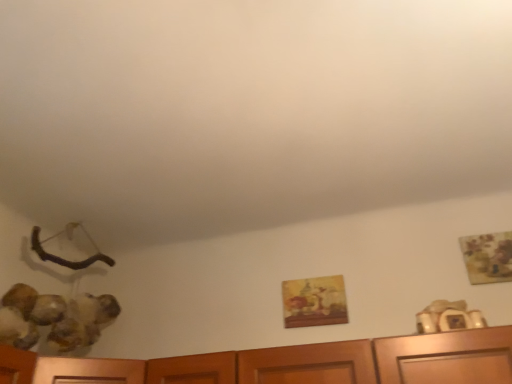
This screenshot has height=384, width=512. What do you see at coordinates (314, 301) in the screenshot? I see `matte wooden picture frame at center, placed as the 1th picture frame when sorted from back to front` at bounding box center [314, 301].

Where is `matte wooden picture frame at center, which is the 1th picture frame from bottom to top`? This screenshot has height=384, width=512. matte wooden picture frame at center, which is the 1th picture frame from bottom to top is located at coordinates (314, 301).

Identify the location of wooden painted picture frame at upper right, which is counted as the 2th picture frame, starting from the left. (488, 257).

Image resolution: width=512 pixels, height=384 pixels. What do you see at coordinates (488, 257) in the screenshot?
I see `wooden painted picture frame at upper right, the second picture frame viewed from the back` at bounding box center [488, 257].

Identify the location of matte wooden picture frame at center, marked as the first picture frame in a left-to-right arrangement. This screenshot has height=384, width=512. (314, 301).

Looking at this image, is matte wooden picture frame at center, acting as the 2th picture frame starting from the front, to the left or to the right of wooden painted picture frame at upper right, the first picture frame viewed from the top, in the image?

In the image, matte wooden picture frame at center, acting as the 2th picture frame starting from the front, appears on the left side of wooden painted picture frame at upper right, the first picture frame viewed from the top.

Is matte wooden picture frame at center, positioned as the second picture frame in right-to-left order, further to the viewer compared to wooden painted picture frame at upper right, which is counted as the 2th picture frame, starting from the left?

Yes, matte wooden picture frame at center, positioned as the second picture frame in right-to-left order, is further from the camera.

Which is further, (320, 301) or (478, 277)?

The point (320, 301) is behind.

From the image's perspective, is matte wooden picture frame at center, positioned as the second picture frame in right-to-left order, located above or below wooden painted picture frame at upper right, which is counted as the 1th picture frame, starting from the front?

matte wooden picture frame at center, positioned as the second picture frame in right-to-left order, is situated lower than wooden painted picture frame at upper right, which is counted as the 1th picture frame, starting from the front, in the image.

In the scene shown: From a real-world perspective, relative to wooden painted picture frame at upper right, which is the 1th picture frame from right to left, is matte wooden picture frame at center, arranged as the 2th picture frame when viewed from the top, vertically above or below?

matte wooden picture frame at center, arranged as the 2th picture frame when viewed from the top, is below wooden painted picture frame at upper right, which is the 1th picture frame from right to left.

Can you confirm if matte wooden picture frame at center, arranged as the 2th picture frame when viewed from the top, is wider than wooden painted picture frame at upper right, the first picture frame viewed from the top?

Yes.

Considering the sizes of objects matte wooden picture frame at center, which is the 1th picture frame from bottom to top, and wooden painted picture frame at upper right, the first picture frame viewed from the top, in the image provided, who is shorter, matte wooden picture frame at center, which is the 1th picture frame from bottom to top, or wooden painted picture frame at upper right, the first picture frame viewed from the top,?

Standing shorter between the two is matte wooden picture frame at center, which is the 1th picture frame from bottom to top.

Who is smaller, matte wooden picture frame at center, positioned as the second picture frame in right-to-left order, or wooden painted picture frame at upper right, which is the 1th picture frame from right to left?

wooden painted picture frame at upper right, which is the 1th picture frame from right to left, is smaller.

Can we say matte wooden picture frame at center, placed as the 1th picture frame when sorted from back to front, lies outside wooden painted picture frame at upper right, which is counted as the 2th picture frame, starting from the left?

matte wooden picture frame at center, placed as the 1th picture frame when sorted from back to front, is positioned outside wooden painted picture frame at upper right, which is counted as the 2th picture frame, starting from the left.

Is matte wooden picture frame at center, which is the 1th picture frame from bottom to top, placed right next to wooden painted picture frame at upper right, the first picture frame viewed from the top?

matte wooden picture frame at center, which is the 1th picture frame from bottom to top, and wooden painted picture frame at upper right, the first picture frame viewed from the top, are clearly separated.

Is matte wooden picture frame at center, marked as the first picture frame in a left-to-right arrangement, turned away from wooden painted picture frame at upper right, the second picture frame viewed from the back?

No, matte wooden picture frame at center, marked as the first picture frame in a left-to-right arrangement, is not facing the opposite direction of wooden painted picture frame at upper right, the second picture frame viewed from the back.

What are the coordinates of `picture frame below the wooden painted picture frame at upper right, which is counted as the 2th picture frame, starting from the left (from the image's perspective)` in the screenshot? It's located at (314, 301).

Considering the positions of objects wooden painted picture frame at upper right, the second picture frame positioned from the bottom, and matte wooden picture frame at center, arranged as the 2th picture frame when viewed from the top, in the image provided, who is more to the right, wooden painted picture frame at upper right, the second picture frame positioned from the bottom, or matte wooden picture frame at center, arranged as the 2th picture frame when viewed from the top,?

wooden painted picture frame at upper right, the second picture frame positioned from the bottom, is more to the right.

Who is more distant, wooden painted picture frame at upper right, the second picture frame positioned from the bottom, or matte wooden picture frame at center, marked as the first picture frame in a left-to-right arrangement?

matte wooden picture frame at center, marked as the first picture frame in a left-to-right arrangement.

Is point (487, 266) positioned in front of point (305, 281)?

Yes, point (487, 266) is in front of point (305, 281).

From the image's perspective, would you say wooden painted picture frame at upper right, which is the 1th picture frame from right to left, is shown under matte wooden picture frame at center, which is the 1th picture frame from bottom to top?

Actually, wooden painted picture frame at upper right, which is the 1th picture frame from right to left, appears above matte wooden picture frame at center, which is the 1th picture frame from bottom to top, in the image.

From a real-world perspective, is wooden painted picture frame at upper right, the second picture frame positioned from the bottom, positioned over matte wooden picture frame at center, arranged as the 2th picture frame when viewed from the top, based on gravity?

Correct, in the physical world, wooden painted picture frame at upper right, the second picture frame positioned from the bottom, is higher than matte wooden picture frame at center, arranged as the 2th picture frame when viewed from the top.

Consider the image. Is wooden painted picture frame at upper right, which is the 1th picture frame from right to left, thinner than matte wooden picture frame at center, which is the 1th picture frame from bottom to top?

Yes, wooden painted picture frame at upper right, which is the 1th picture frame from right to left, is thinner than matte wooden picture frame at center, which is the 1th picture frame from bottom to top.

Which of these two, wooden painted picture frame at upper right, the first picture frame viewed from the top, or matte wooden picture frame at center, placed as the 1th picture frame when sorted from back to front, stands shorter?

With less height is matte wooden picture frame at center, placed as the 1th picture frame when sorted from back to front.

Considering the relative sizes of wooden painted picture frame at upper right, which is counted as the 2th picture frame, starting from the left, and matte wooden picture frame at center, marked as the first picture frame in a left-to-right arrangement, in the image provided, is wooden painted picture frame at upper right, which is counted as the 2th picture frame, starting from the left, bigger than matte wooden picture frame at center, marked as the first picture frame in a left-to-right arrangement,?

Incorrect, wooden painted picture frame at upper right, which is counted as the 2th picture frame, starting from the left, is not larger than matte wooden picture frame at center, marked as the first picture frame in a left-to-right arrangement.

Could matte wooden picture frame at center, placed as the 1th picture frame when sorted from back to front, be considered to be inside wooden painted picture frame at upper right, the second picture frame positioned from the bottom?

No, wooden painted picture frame at upper right, the second picture frame positioned from the bottom, does not contain matte wooden picture frame at center, placed as the 1th picture frame when sorted from back to front.

Would you consider wooden painted picture frame at upper right, which is counted as the 1th picture frame, starting from the front, to be distant from matte wooden picture frame at center, marked as the first picture frame in a left-to-right arrangement?

No, wooden painted picture frame at upper right, which is counted as the 1th picture frame, starting from the front, is in close proximity to matte wooden picture frame at center, marked as the first picture frame in a left-to-right arrangement.

Is wooden painted picture frame at upper right, the first picture frame viewed from the top, facing away from matte wooden picture frame at center, which is the 1th picture frame from bottom to top?

No.

What's the angular difference between wooden painted picture frame at upper right, which is counted as the 2th picture frame, starting from the left, and matte wooden picture frame at center, arranged as the 2th picture frame when viewed from the top,'s facing directions?

The angle between the facing direction of wooden painted picture frame at upper right, which is counted as the 2th picture frame, starting from the left, and the facing direction of matte wooden picture frame at center, arranged as the 2th picture frame when viewed from the top, is 0.00855 degrees.

How much distance is there between wooden painted picture frame at upper right, the second picture frame positioned from the bottom, and matte wooden picture frame at center, acting as the 2th picture frame starting from the front?

They are 21.77 inches apart.

Find the location of a particular element. Image resolution: width=512 pixels, height=384 pixels. picture frame located behind the wooden painted picture frame at upper right, which is the 1th picture frame from right to left is located at coordinates (314, 301).

Where is `picture frame above the matte wooden picture frame at center, positioned as the second picture frame in right-to-left order (from a real-world perspective)`? This screenshot has width=512, height=384. picture frame above the matte wooden picture frame at center, positioned as the second picture frame in right-to-left order (from a real-world perspective) is located at coordinates (488, 257).

Identify the location of picture frame lying in front of the matte wooden picture frame at center, acting as the 2th picture frame starting from the front. This screenshot has height=384, width=512. (488, 257).